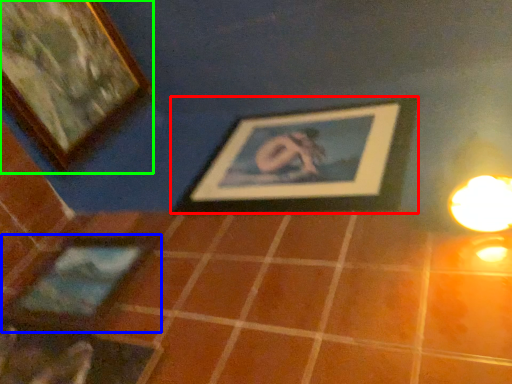
Question: Which object is the closest to the picture frame (highlighted by a red box)? Choose among these: picture frame (highlighted by a blue box) or picture frame (highlighted by a green box).

Choices:
 (A) picture frame
 (B) picture frame

Answer: (A)